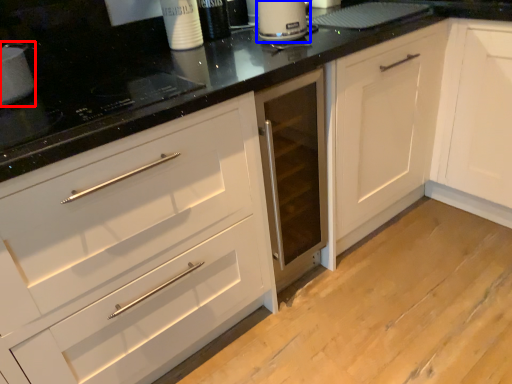
Question: Which point is further to the camera, appliance (highlighted by a red box) or kitchen appliance (highlighted by a blue box)?

Choices:
 (A) appliance
 (B) kitchen appliance

Answer: (B)